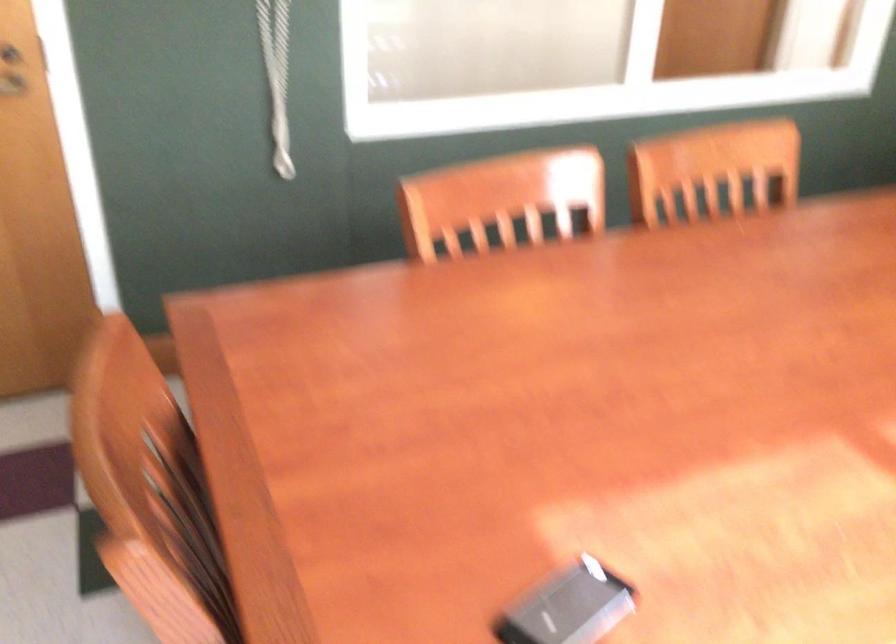
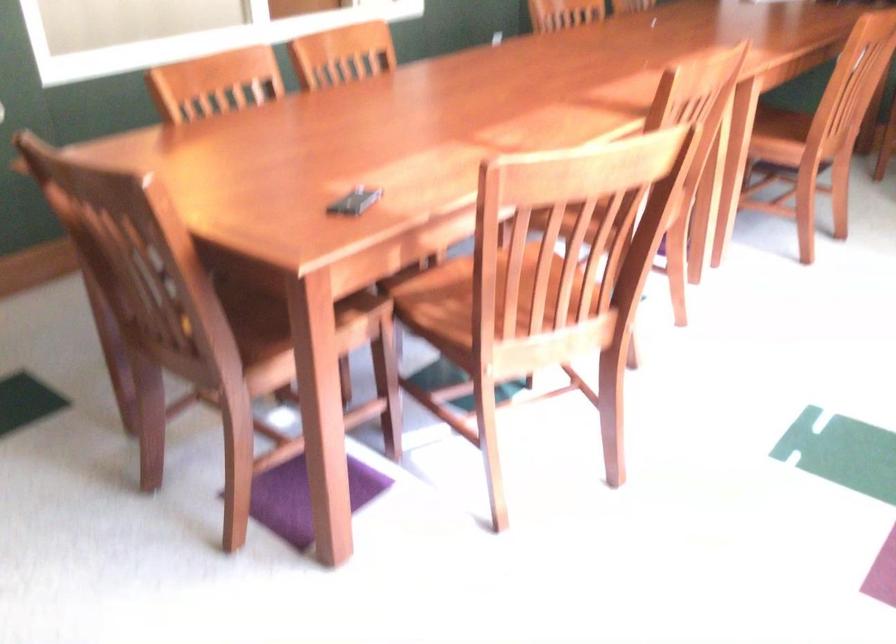
In a continuous first-person perspective shot, in which direction is the camera moving?

The movement direction of the cameraman is left, backward.